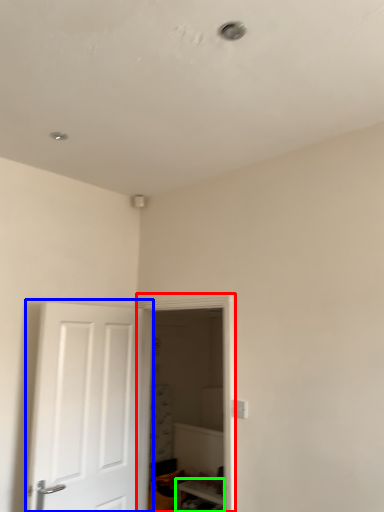
Question: Which object is the closest to the glass door (highlighted by a red box)? Choose among these: door (highlighted by a blue box) or furniture (highlighted by a green box).

Choices:
 (A) door
 (B) furniture

Answer: (A)